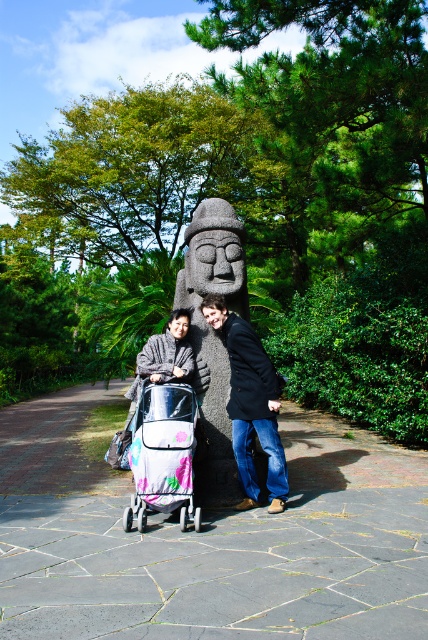
You are a photographer trying to capture a clear shot of the dark gray stone statue at center and the gray woolen sweater at center. Which object should you focus on first if you want to ensure both are in focus?

The dark gray stone statue at center is positioned over gray woolen sweater at center, so you should focus on the dark gray stone statue at center first to ensure both are in focus.

Based on the photo, you are standing in front of the statue and want to place two markers on the ground at the specified coordinates. Which marker location, point (208, 369) or point (264, 392), is closer to you?

Point (208, 369) is closer to you because it is further to the viewer than point (264, 392).

You are standing in the park and see the dark gray stone statue at center and the black matte jacket at center. Which object is positioned higher in the image?

The dark gray stone statue at center is located above the black matte jacket at center, so it is positioned higher in the image.